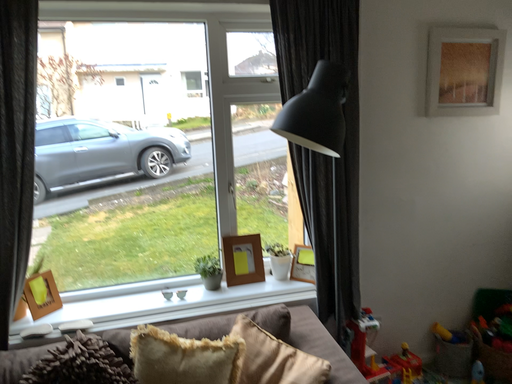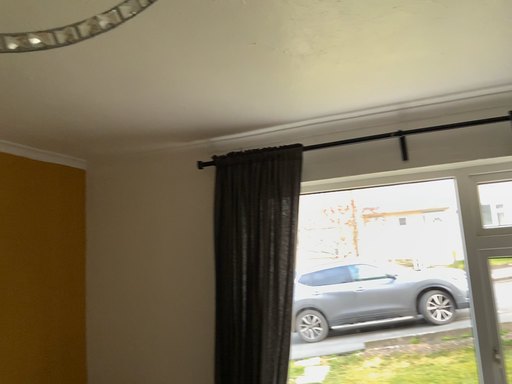
Question: How did the camera likely rotate when shooting the video?

Choices:
 (A) rotated upward
 (B) rotated downward

Answer: (A)